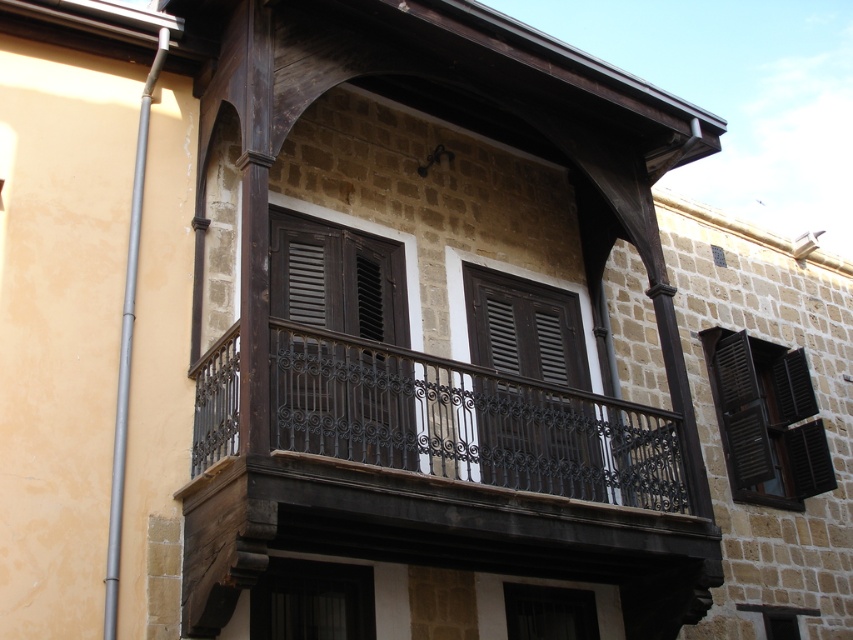
Between dark brown wrought iron balcony at center and black matte wood window at center, which one is positioned lower?

black matte wood window at center is lower down.

Consider the image. Who is positioned more to the left, dark brown wrought iron balcony at center or black matte wood window at center?

dark brown wrought iron balcony at center

Locate an element on the screen. The image size is (853, 640). dark brown wrought iron balcony at center is located at coordinates (436, 477).

Is point (708, 570) closer to viewer compared to point (584, 484)?

Yes, it is in front of point (584, 484).

Measure the distance between point (384, 371) and camera.

Point (384, 371) is 83.14 feet from camera.

The width and height of the screenshot is (853, 640). What do you see at coordinates (436, 477) in the screenshot?
I see `dark brown wrought iron balcony at center` at bounding box center [436, 477].

The width and height of the screenshot is (853, 640). What are the coordinates of `dark brown wrought iron balcony at center` in the screenshot? It's located at (436, 477).

What do you see at coordinates (766, 419) in the screenshot? The height and width of the screenshot is (640, 853). I see `black matte wood window at center` at bounding box center [766, 419].

Does point (724, 348) lie behind point (367, 582)?

That is True.

Between point (799, 355) and point (322, 586), which one is positioned behind?

The point (799, 355) is more distant.

What are the coordinates of `black matte wood window at center` in the screenshot? It's located at (766, 419).